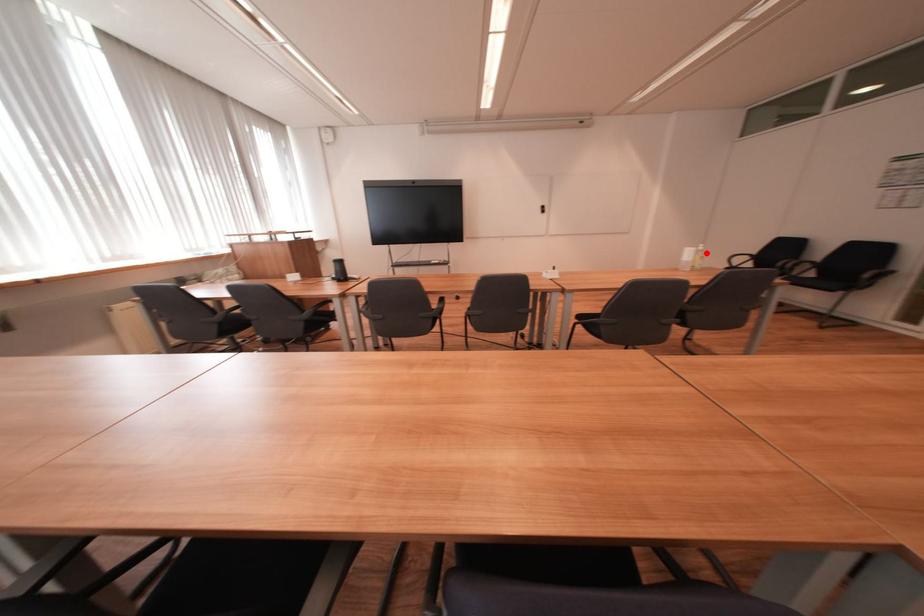
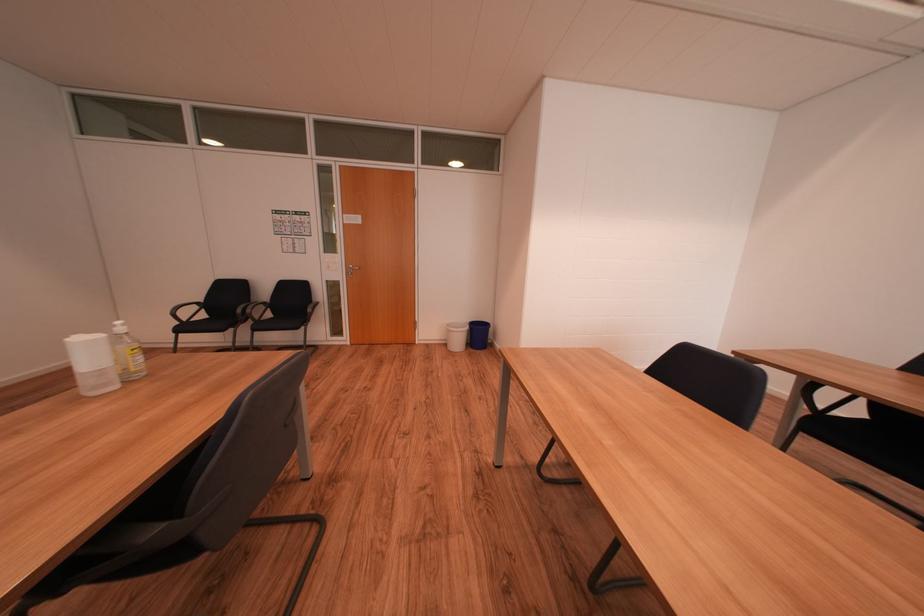
Where in the second image is the point corresponding to the highlighted location from the first image?

(126, 339)